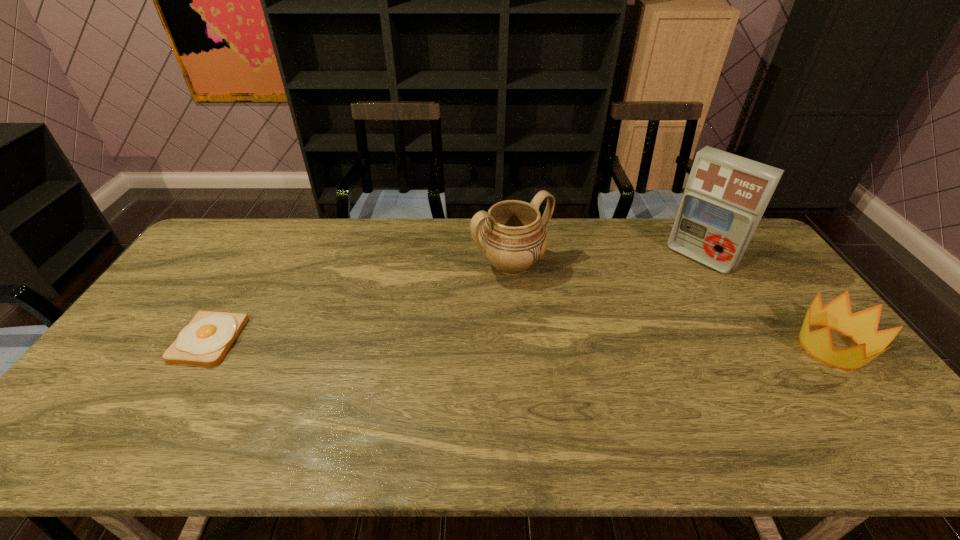
I want to click on free spot located on the front-facing side of the third object from left to right, so click(x=640, y=314).

Where is `vacant position located on the front-facing side of the third object from left to right`? The height and width of the screenshot is (540, 960). vacant position located on the front-facing side of the third object from left to right is located at coordinates (635, 319).

The image size is (960, 540). I want to click on vacant space situated 0.100m on the front-facing side of the third object from left to right, so click(x=671, y=285).

Where is `free space located on the front-facing side of the third object from right to left`? Image resolution: width=960 pixels, height=540 pixels. free space located on the front-facing side of the third object from right to left is located at coordinates (587, 333).

Locate an element on the screen. The width and height of the screenshot is (960, 540). free space located on the front-facing side of the third object from right to left is located at coordinates (579, 326).

This screenshot has height=540, width=960. What are the coordinates of `free spot located 0.380m on the front-facing side of the third object from right to left` in the screenshot? It's located at (623, 367).

Find the location of a particular element. the first-aid kit located at the far edge is located at coordinates (726, 195).

Find the location of a particular element. The height and width of the screenshot is (540, 960). urn that is at the far edge is located at coordinates (513, 237).

The width and height of the screenshot is (960, 540). Identify the location of object that is positioned at the left edge. (205, 341).

The image size is (960, 540). Find the location of `crown that is at the right edge`. crown that is at the right edge is located at coordinates (862, 326).